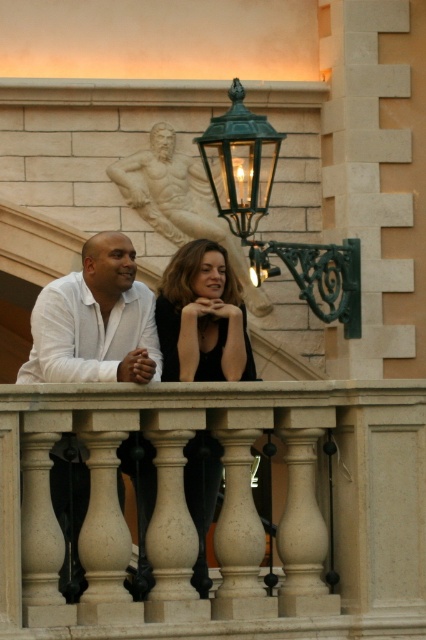
You are standing on the balcony and want to hang a new decorative item exactly where the green metal lantern at upper center is currently located. What are the coordinates you should aim for?

The coordinates are at point (x=265, y=212).

You are standing at the camera position looking at the scene. There is a point at coordinates point (224, 154). Can you estimate how far this point is from your current position?

The point (224, 154) is 47.44 meters away from the camera position.

You are standing on the balcony and want to place a small potted plant between the white marble balustrade at center and the bronze statue at upper center. Based on their positions, which object should the plant be closer to?

The white marble balustrade at center is to the right of the bronze statue at upper center, so the plant should be placed closer to the bronze statue at upper center to maintain symmetry.